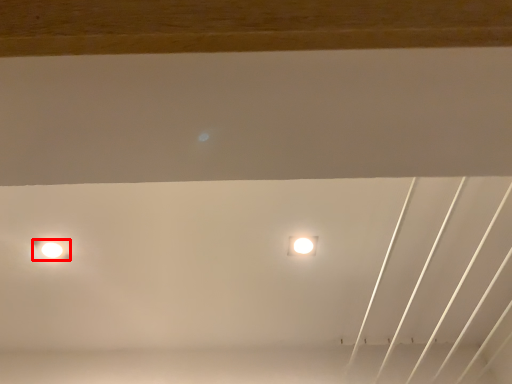
Question: Considering the relative positions of lamp (annotated by the red box) and lamp in the image provided, where is lamp (annotated by the red box) located with respect to the staircase?

Choices:
 (A) left
 (B) right

Answer: (A)